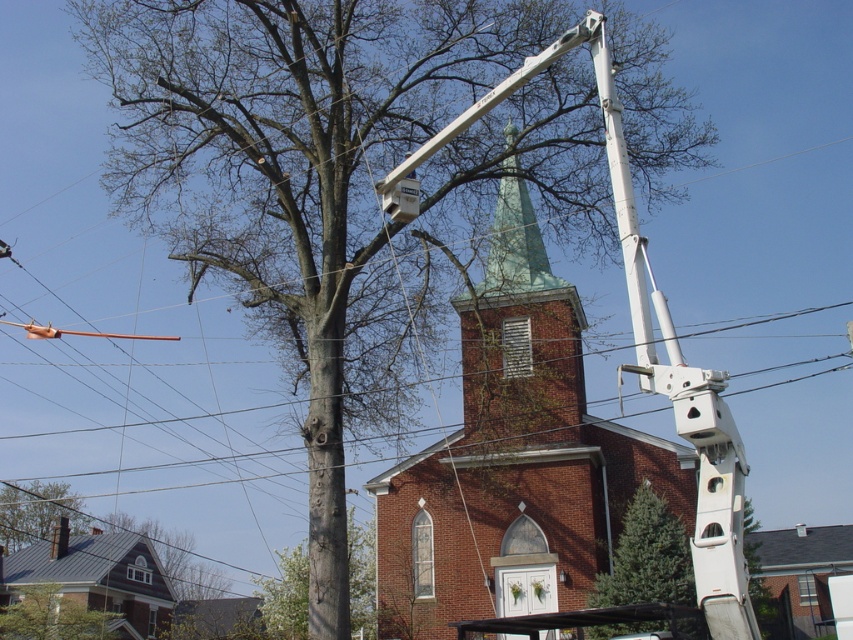
Looking at this image, you are standing at the entrance of the brick church at center. If you look towards the direction where the utility truck is parked, which side of the church would you see the truck relative to your position?

The utility truck is positioned to the right of the frame relative to the brick church at center, so if you are standing at the entrance of the brick church at center facing outward, the truck would be on your right side.

You are standing at the viewing position and want to place a new bench 10 meters away from the green textured evergreen tree at lower right. Can you determine if the bench will be within the church property? Please explain your reasoning based on the distance provided.

The green textured evergreen tree at lower right is 32.04 meters away from the viewer. Placing a bench 10 meters from it would place the bench at 22.04 meters from the viewer. Without knowing the exact boundaries of the church property, it is impossible to confirm if the bench would be within the property. The distance alone does not provide information about property lines.

You are a utility worker standing near the brick church at center and the smooth gray bark at center. Which object is higher up in the image?

The brick church at center is positioned over the smooth gray bark at center, so the brick church at center is higher up in the image.